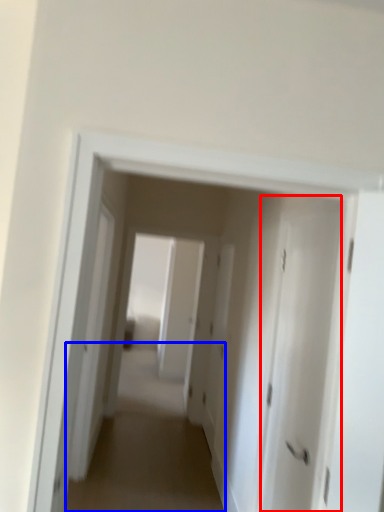
Question: Which point is further to the camera, door (highlighted by a red box) or alley (highlighted by a blue box)?

Choices:
 (A) door
 (B) alley

Answer: (B)